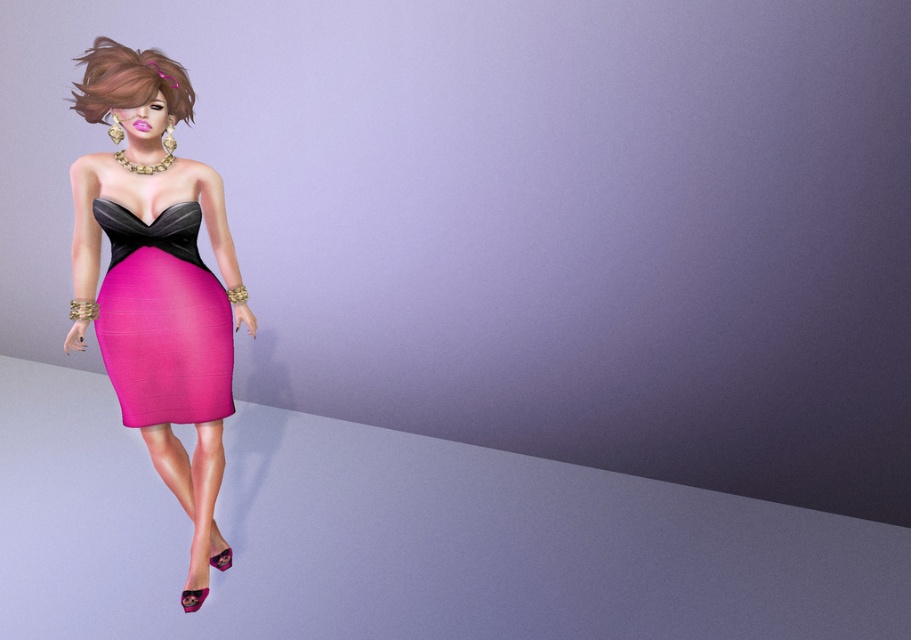
You are a fashion designer analyzing the image. You need to decide which item is wider between the matte pink fabric dress at left and the brown shiny hair at upper left. Which one is wider?

The matte pink fabric dress at left is wider than the brown shiny hair at upper left according to the description.

You are an artist trying to sketch the character from the image. You notice the matte pink dress at left and the brown shiny hair at upper left. Which object should you draw first if you want to start with the wider one?

The matte pink dress at left might be wider than brown shiny hair at upper left, so you should draw the matte pink dress at left first.